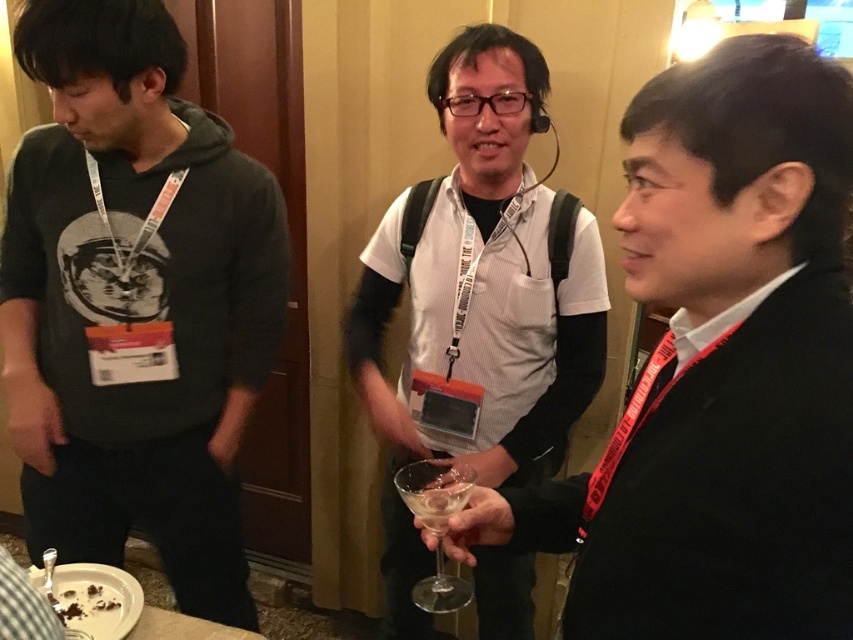
Question: Among these objects, which one is farthest from the camera?

Choices:
 (A) black suit at center
 (B) clear glass at center
 (C) matte black hoodie at left

Answer: (C)

Question: Does black suit at center appear on the right side of matte black hoodie at left?

Choices:
 (A) yes
 (B) no

Answer: (A)

Question: Is matte black hoodie at left to the right of clear glass at center from the viewer's perspective?

Choices:
 (A) yes
 (B) no

Answer: (B)

Question: Which object is farther from the camera taking this photo?

Choices:
 (A) matte black hoodie at left
 (B) white striped shirt at center
 (C) black suit at center
 (D) clear glass at center

Answer: (B)

Question: Is black suit at center behind matte black hoodie at left?

Choices:
 (A) yes
 (B) no

Answer: (B)

Question: Which point is closer to the camera?

Choices:
 (A) (410, 465)
 (B) (720, 72)
 (C) (412, 296)

Answer: (B)